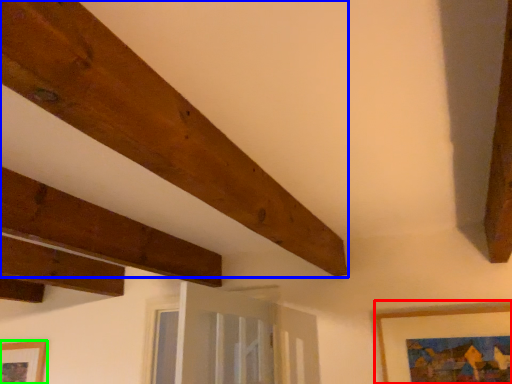
Question: Which object is positioned farthest from picture frame (highlighted by a red box)? Select from plank (highlighted by a blue box) and picture frame (highlighted by a green box).

Choices:
 (A) plank
 (B) picture frame

Answer: (B)